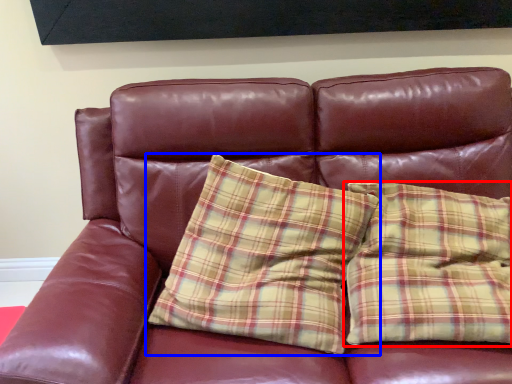
Question: Which point is closer to the camera, pillow (highlighted by a red box) or pillow (highlighted by a blue box)?

Choices:
 (A) pillow
 (B) pillow

Answer: (A)